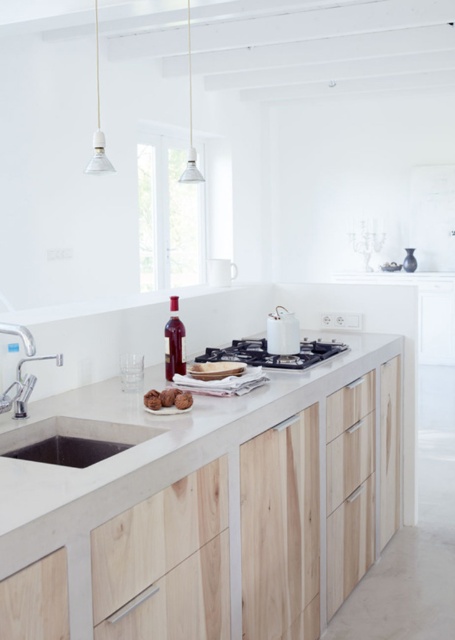
Question: Which point is farther to the camera?

Choices:
 (A) white glossy stove at center
 (B) matte white sink at lower left

Answer: (A)

Question: Is matte white sink at lower left further to camera compared to matte concrete sink at lower left?

Choices:
 (A) yes
 (B) no

Answer: (B)

Question: Where is concrete/wooden counter top at center located in relation to brown matte muffins at center in the image?

Choices:
 (A) above
 (B) below

Answer: (B)

Question: From the image, what is the correct spatial relationship of white glossy stove at center in relation to brushed metal faucet at lower left?

Choices:
 (A) below
 (B) above

Answer: (B)

Question: Considering the real-world distances, which object is closest to the matte concrete sink at lower left?

Choices:
 (A) brown matte muffins at center
 (B) white glossy glass at center
 (C) matte white sink at lower left
 (D) concrete/wooden counter top at center

Answer: (C)

Question: Which point is farther from the camera taking this photo?

Choices:
 (A) (289, 337)
 (B) (52, 444)

Answer: (A)